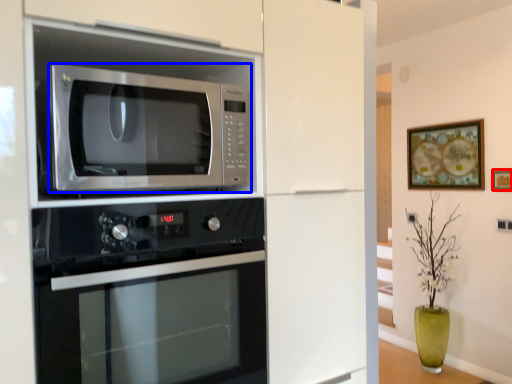
Question: Which of the following is the farthest to the observer, picture frame (highlighted by a red box) or microwave oven (highlighted by a blue box)?

Choices:
 (A) picture frame
 (B) microwave oven

Answer: (A)